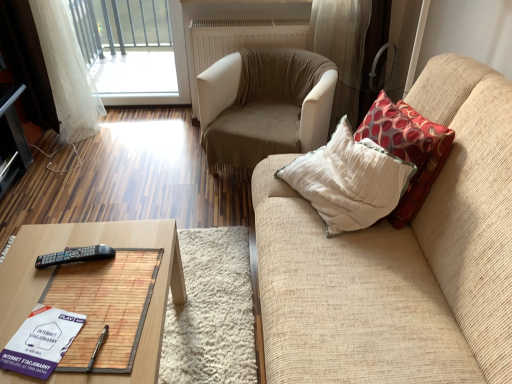
Locate an element on the screen. Image resolution: width=512 pixels, height=384 pixels. free spot in front of transparent glass window at upper left is located at coordinates (114, 134).